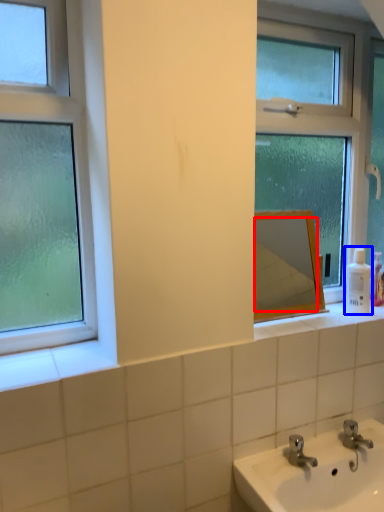
Question: Which object appears closest to the camera in this image, mirror (highlighted by a red box) or toiletry (highlighted by a blue box)?

Choices:
 (A) mirror
 (B) toiletry

Answer: (A)